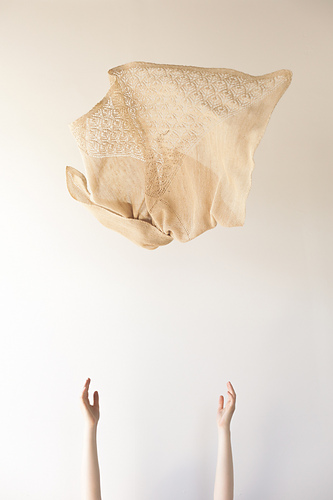
Identify the location of tablecloth. This screenshot has height=500, width=333. (156, 167).